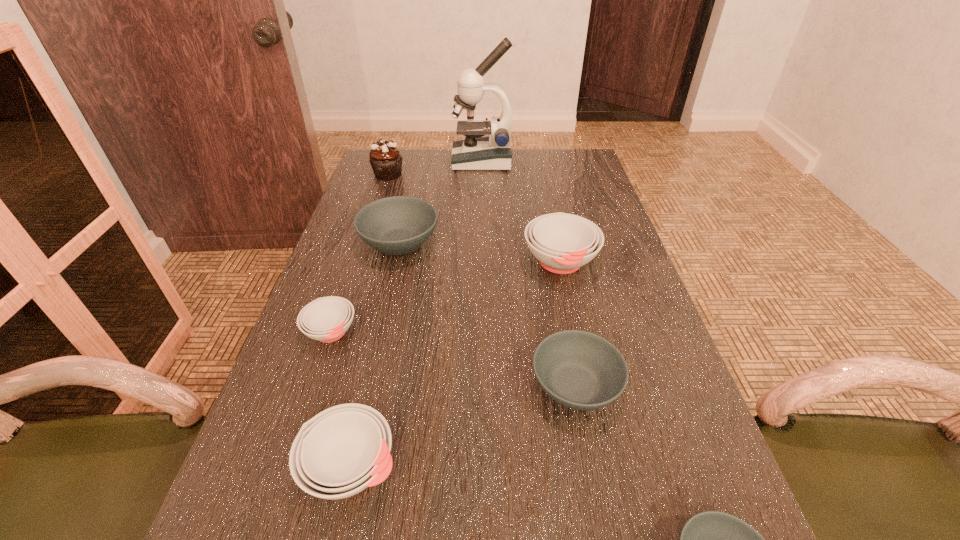
Locate an element on the screen. cupcake that is at the far edge is located at coordinates (386, 161).

In order to click on cupcake present at the left edge in this screenshot , I will do `click(386, 161)`.

Find the location of a particular element. Image resolution: width=960 pixels, height=540 pixels. object that is positioned at the far left corner is located at coordinates (386, 161).

The height and width of the screenshot is (540, 960). What are the coordinates of `free space at the far edge of the desktop` in the screenshot? It's located at (439, 180).

Identify the location of free space at the left edge of the desktop. (351, 202).

This screenshot has height=540, width=960. What are the coordinates of `vacant area at the right edge of the desktop` in the screenshot? It's located at (637, 322).

At what (x,y) coordinates should I click in order to perform the action: click on vacant region at the far right corner. Please return your answer as a coordinate pair (x, y). Looking at the image, I should click on (556, 161).

Identify the location of empty space that is in between the biggest gray soup bowl and the second biggest gray soup bowl. The image size is (960, 540). click(488, 314).

The height and width of the screenshot is (540, 960). In order to click on free space between the second biggest gray soup bowl and the nearest white soup bowl in this screenshot , I will do `click(464, 427)`.

Where is `free area in between the nearest white soup bowl and the smallest white soup bowl`? free area in between the nearest white soup bowl and the smallest white soup bowl is located at coordinates (341, 400).